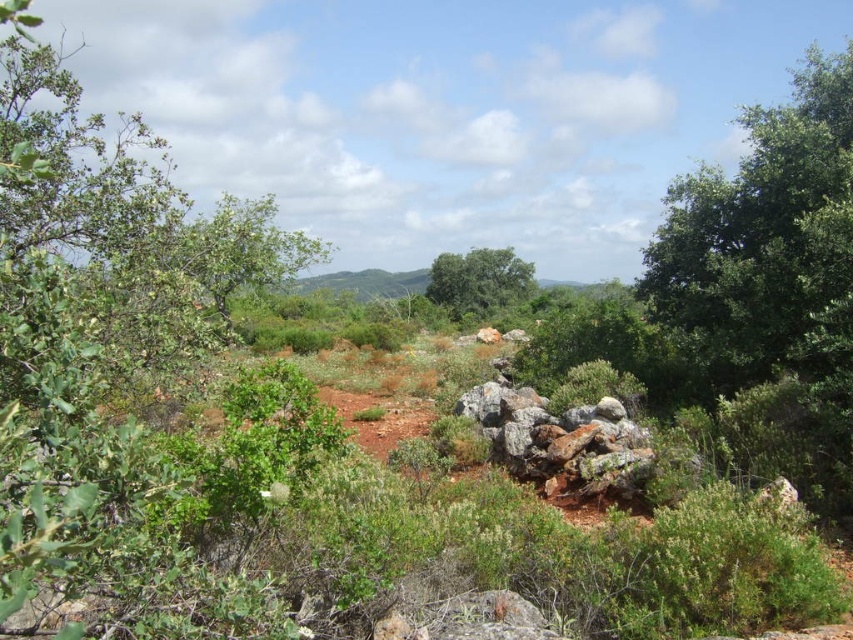
Question: Is green leafy tree at left bigger than green leafy tree at center?

Choices:
 (A) yes
 (B) no

Answer: (A)

Question: Which point is farther from the camera taking this photo?

Choices:
 (A) (45, 332)
 (B) (515, 300)

Answer: (B)

Question: Is green leafy tree at left to the left of green leafy tree at center from the viewer's perspective?

Choices:
 (A) no
 (B) yes

Answer: (B)

Question: Is green leafy tree at left closer to the viewer compared to green leafy tree at center?

Choices:
 (A) no
 (B) yes

Answer: (B)

Question: Which object appears farthest from the camera in this image?

Choices:
 (A) green leafy tree at left
 (B) green leafy tree at center

Answer: (B)